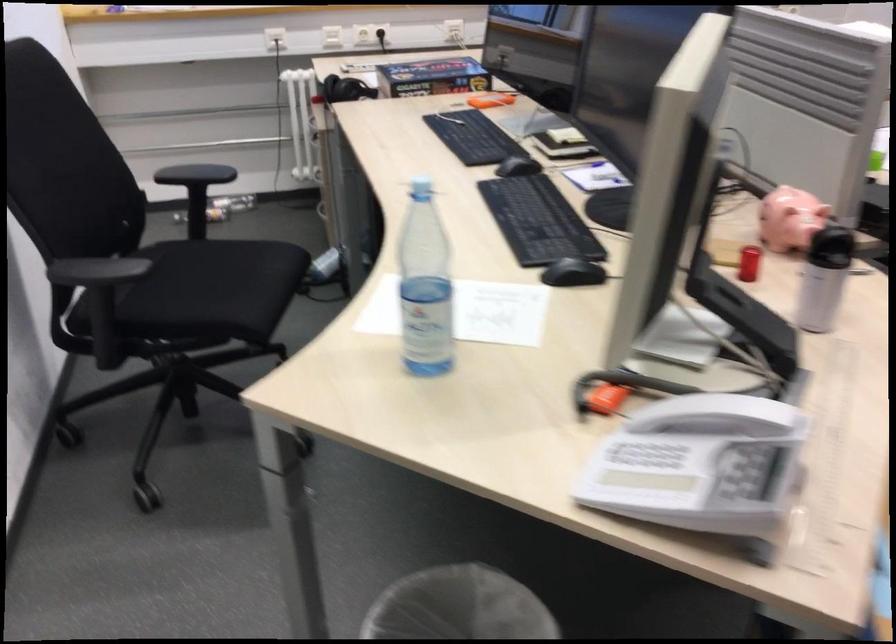
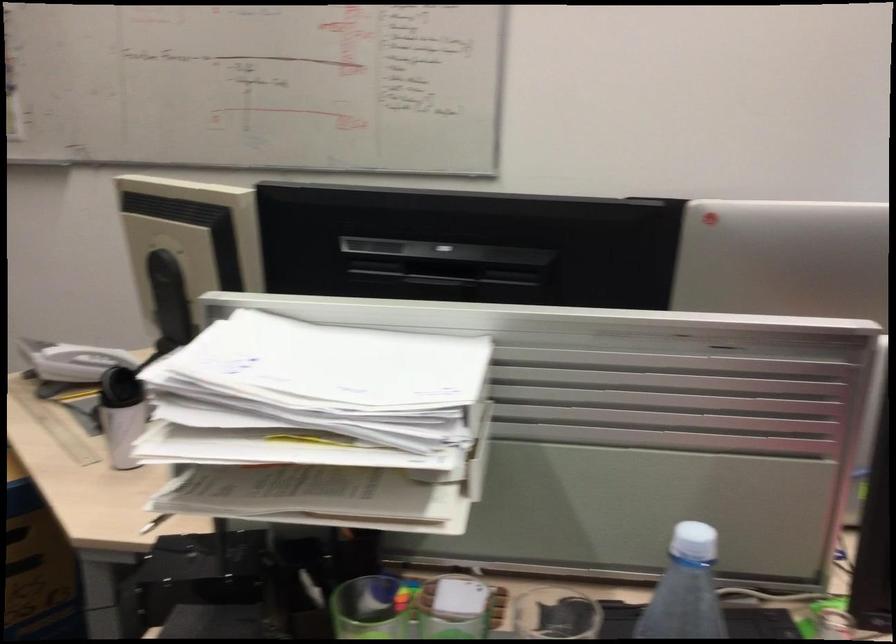
Question: I am providing you with two images of the same scene from different viewpoints. Please identify which objects are invisible in image2.

Choices:
 (A) white paper tray
 (B) white smartphone
 (C) white telephone handset
 (D) none of these

Answer: (D)